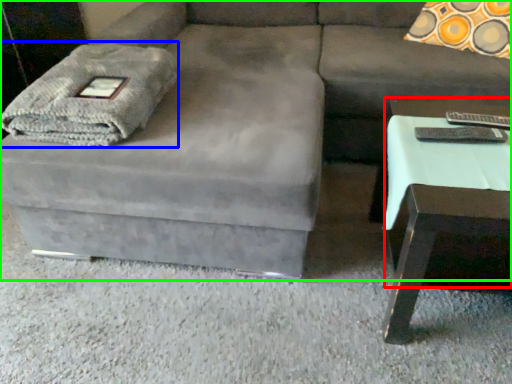
Question: Based on their relative distances, which object is farther from side table (highlighted by a red box)? Choose from blanket (highlighted by a blue box) and studio couch (highlighted by a green box).

Choices:
 (A) blanket
 (B) studio couch

Answer: (A)